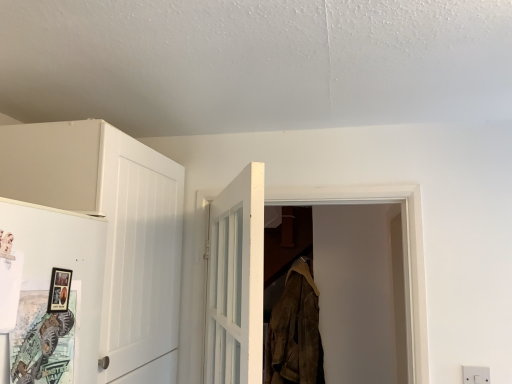
Question: Is white plastic electric outlet at lower right thinner than brown suede jacket at center?

Choices:
 (A) no
 (B) yes

Answer: (B)

Question: Considering the relative sizes of white plastic electric outlet at lower right and brown suede jacket at center in the image provided, is white plastic electric outlet at lower right taller than brown suede jacket at center?

Choices:
 (A) yes
 (B) no

Answer: (B)

Question: Is white plastic electric outlet at lower right oriented away from brown suede jacket at center?

Choices:
 (A) no
 (B) yes

Answer: (A)

Question: Is white plastic electric outlet at lower right smaller than brown suede jacket at center?

Choices:
 (A) yes
 (B) no

Answer: (A)

Question: Does white plastic electric outlet at lower right have a lesser height compared to brown suede jacket at center?

Choices:
 (A) yes
 (B) no

Answer: (A)

Question: From a real-world perspective, is matte white door at left, the second door in the right-to-left sequence, positioned above or below brown suede jacket at center?

Choices:
 (A) below
 (B) above

Answer: (B)

Question: From the image's perspective, is matte white door at left, the 2th door when ordered from back to front, located above or below brown suede jacket at center?

Choices:
 (A) below
 (B) above

Answer: (B)

Question: In the image, is matte white door at left, acting as the 1th door starting from the front, positioned in front of or behind brown suede jacket at center?

Choices:
 (A) front
 (B) behind

Answer: (A)

Question: Is matte white door at left, acting as the 1th door starting from the front, to the left or to the right of brown suede jacket at center in the image?

Choices:
 (A) left
 (B) right

Answer: (A)

Question: Looking at the image, does white plastic electric outlet at lower right seem bigger or smaller compared to matte black picture frame at left?

Choices:
 (A) small
 (B) big

Answer: (B)

Question: From the image's perspective, is white plastic electric outlet at lower right positioned above or below matte black picture frame at left?

Choices:
 (A) below
 (B) above

Answer: (A)

Question: Does point (474, 380) appear closer or farther from the camera than point (56, 268)?

Choices:
 (A) closer
 (B) farther

Answer: (B)

Question: Considering the relative positions of white plastic electric outlet at lower right and matte black picture frame at left in the image provided, is white plastic electric outlet at lower right to the left or to the right of matte black picture frame at left?

Choices:
 (A) right
 (B) left

Answer: (A)

Question: From a real-world perspective, is white plastic electric outlet at lower right positioned above or below matte white door at left, the second door in the right-to-left sequence?

Choices:
 (A) above
 (B) below

Answer: (B)

Question: Looking at their shapes, would you say white plastic electric outlet at lower right is wider or thinner than matte white door at left, the first door positioned from the left?

Choices:
 (A) thin
 (B) wide

Answer: (A)